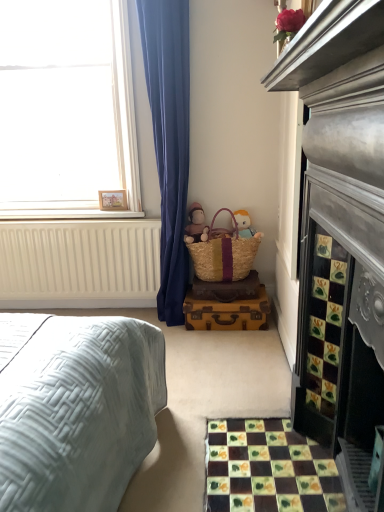
Locate an element on the screen. free space underneath woven straw picnic basket at lower center (from a real-world perspective) is located at coordinates (226, 282).